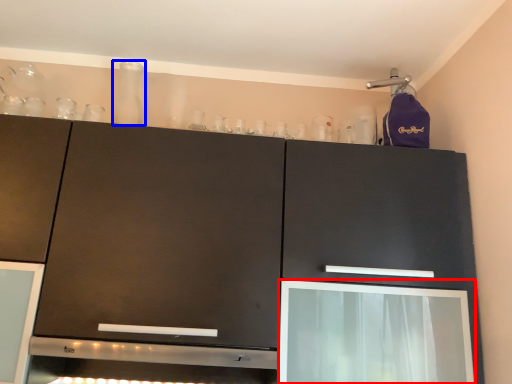
Question: Which point is further to the camera, screen door (highlighted by a red box) or glass vase (highlighted by a blue box)?

Choices:
 (A) screen door
 (B) glass vase

Answer: (B)